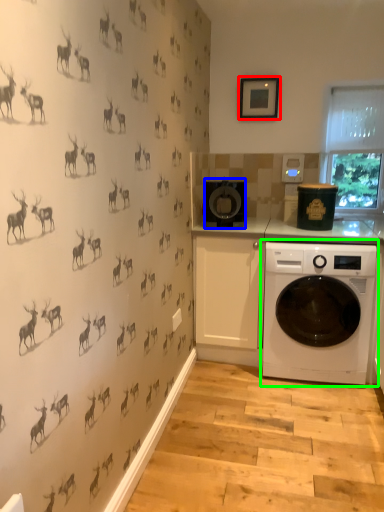
Question: Which object is the closest to the picture frame (highlighted by a red box)? Choose among these: appliance (highlighted by a blue box) or washing machine (highlighted by a green box).

Choices:
 (A) appliance
 (B) washing machine

Answer: (A)